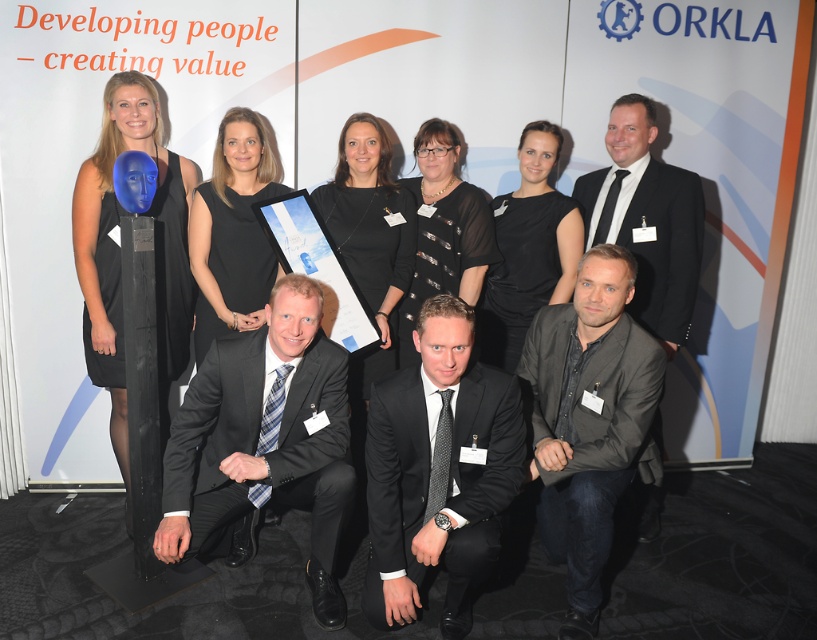
Question: From the image, what is the correct spatial relationship of black suit at center in relation to black matte dress at upper center?

Choices:
 (A) above
 (B) below

Answer: (B)

Question: Which object is farther from the camera taking this photo?

Choices:
 (A) black suit at center
 (B) black matte dress at upper center

Answer: (B)

Question: Is black satin suit at center thinner than dark gray suit at lower right?

Choices:
 (A) yes
 (B) no

Answer: (B)

Question: Which object appears farthest from the camera in this image?

Choices:
 (A) gray fabric suit at lower right
 (B) black suit at center
 (C) blue glossy mask at left
 (D) blue matte mask at upper center

Answer: (A)

Question: Which point appears closest to the camera in this image?

Choices:
 (A) click(x=427, y=282)
 (B) click(x=559, y=202)

Answer: (B)

Question: Is dark gray suit at lower right positioned before gray fabric suit at lower right?

Choices:
 (A) no
 (B) yes

Answer: (B)